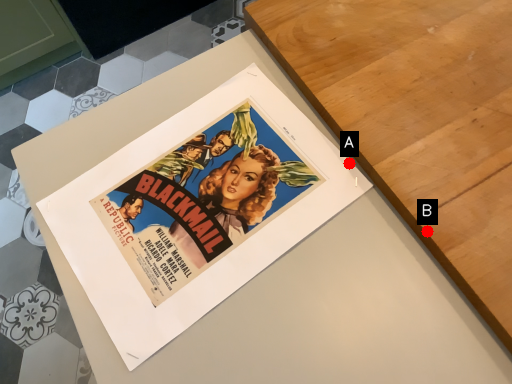
Question: Two points are circled on the image, labeled by A and B beside each circle. Which point is closer to the camera?

Choices:
 (A) A is closer
 (B) B is closer

Answer: (B)